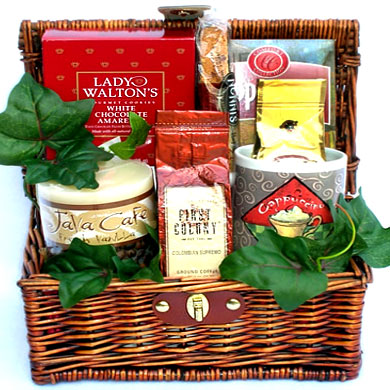
The height and width of the screenshot is (390, 390). In order to click on top of basket in this screenshot , I will do `click(294, 24)`.